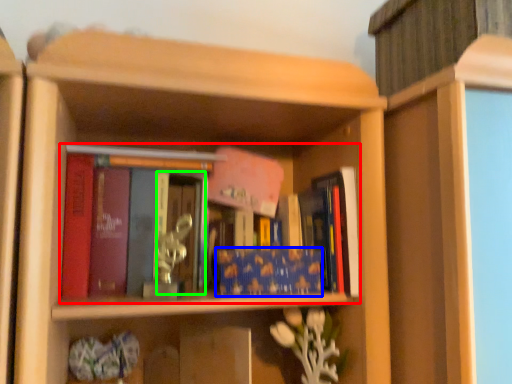
Question: Estimate the real-world distances between objects in this image. Which object is farther from book (highlighted by a red box), book (highlighted by a blue box) or glass door (highlighted by a green box)?

Choices:
 (A) book
 (B) glass door

Answer: (A)